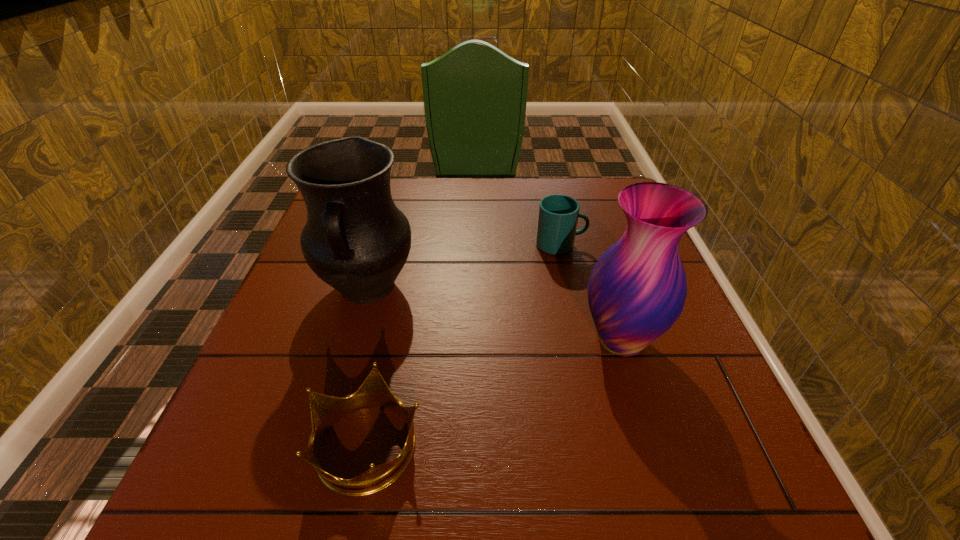
I want to click on vase, so click(637, 289).

What are the coordinates of `pitcher` in the screenshot? It's located at (355, 239).

This screenshot has width=960, height=540. I want to click on cup, so click(x=558, y=214).

Where is `crown`? The width and height of the screenshot is (960, 540). crown is located at coordinates (325, 410).

Image resolution: width=960 pixels, height=540 pixels. What are the coordinates of `the nearest object` in the screenshot? It's located at (x=325, y=410).

Where is `free space located on the back of the vase`? free space located on the back of the vase is located at coordinates (594, 256).

Identify the location of vacant area located 0.350m on the handle side of the pitcher. This screenshot has height=540, width=960. (305, 503).

Find the location of a particular element. vacant region located on the handle side of the cup is located at coordinates (629, 245).

Identify the location of vacant region located on the back of the shortest object. (394, 320).

Where is `object that is at the near edge`? This screenshot has height=540, width=960. object that is at the near edge is located at coordinates (325, 410).